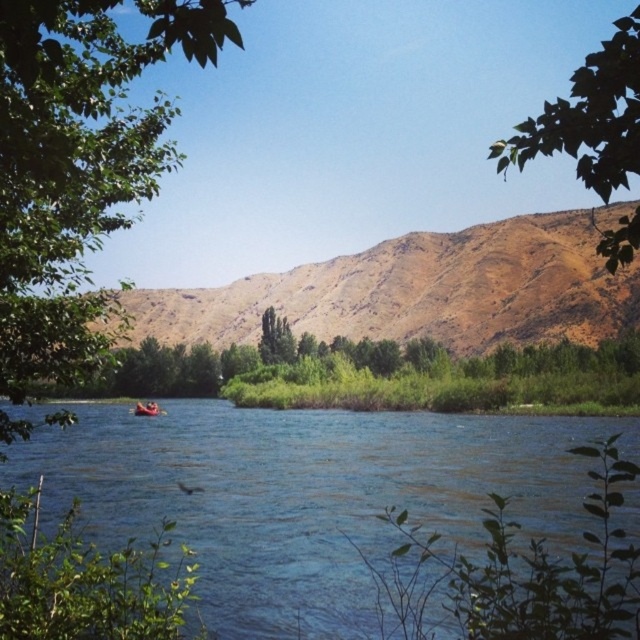
Question: Is blue water at center smaller than green leafy tree at left?

Choices:
 (A) no
 (B) yes

Answer: (B)

Question: Is green leafy tree at upper right bigger than rubber boat at center?

Choices:
 (A) no
 (B) yes

Answer: (B)

Question: Which of the following is the closest to the observer?

Choices:
 (A) green leafy tree at upper right
 (B) brown/dry soil at center
 (C) green leafy tree at left
 (D) blue water at center

Answer: (C)

Question: Which is farther from the green leafy tree at upper right?

Choices:
 (A) green leafy tree at left
 (B) green leafy tree at center
 (C) brown/dry soil at center
 (D) rubber boat at center

Answer: (D)

Question: Does green leafy tree at left appear over green leafy tree at upper right?

Choices:
 (A) yes
 (B) no

Answer: (B)

Question: Which object is closer to the camera taking this photo?

Choices:
 (A) green leafy tree at center
 (B) brown/dry soil at center
 (C) rubber boat at center
 (D) blue water at center

Answer: (B)